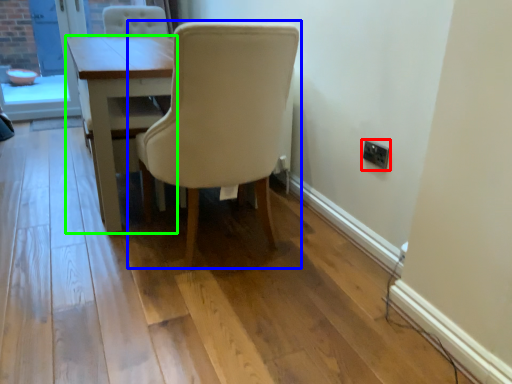
Question: Estimate the real-world distances between objects in this image. Which object is farther from electric outlet (highlighted by a red box), chair (highlighted by a blue box) or table (highlighted by a green box)?

Choices:
 (A) chair
 (B) table

Answer: (B)